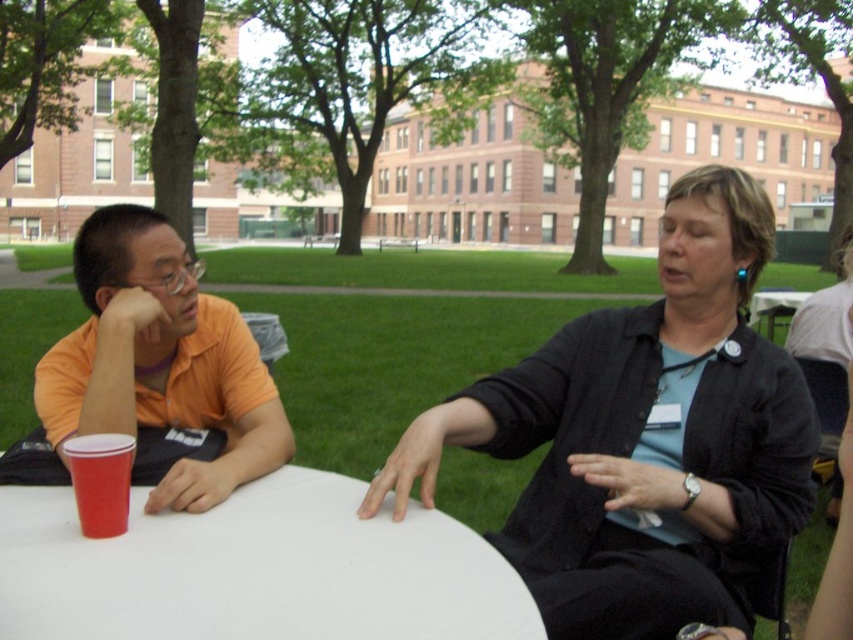
You are standing at the origin point in the image. The black fabric jacket at center is represented by point (646, 440). Is the black fabric jacket at center closer to the top or bottom of the image?

The black fabric jacket at center is represented by point (646, 440). Since the y coordinate is 0.758, which is closer to 1.0, the top of the image, the black fabric jacket at center is closer to the top of the image.